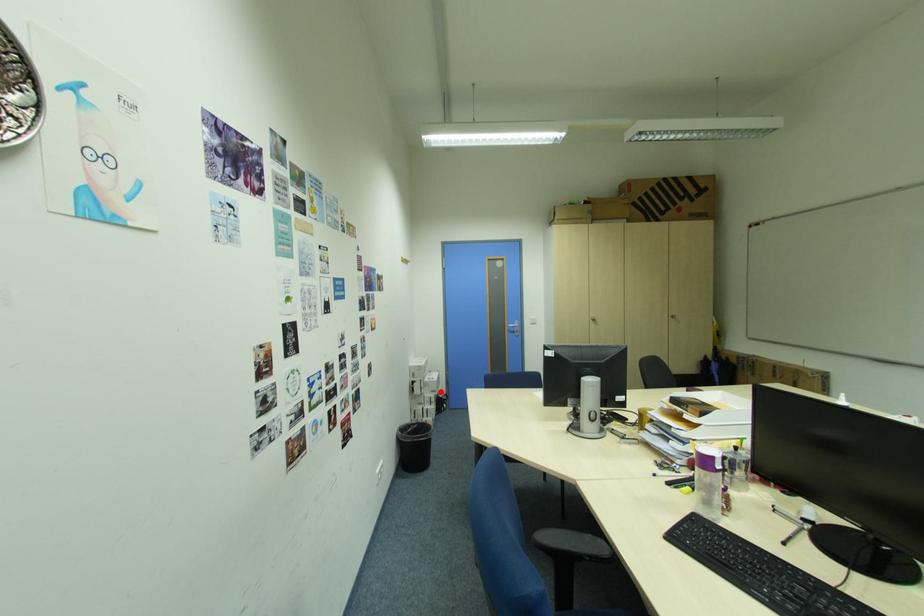
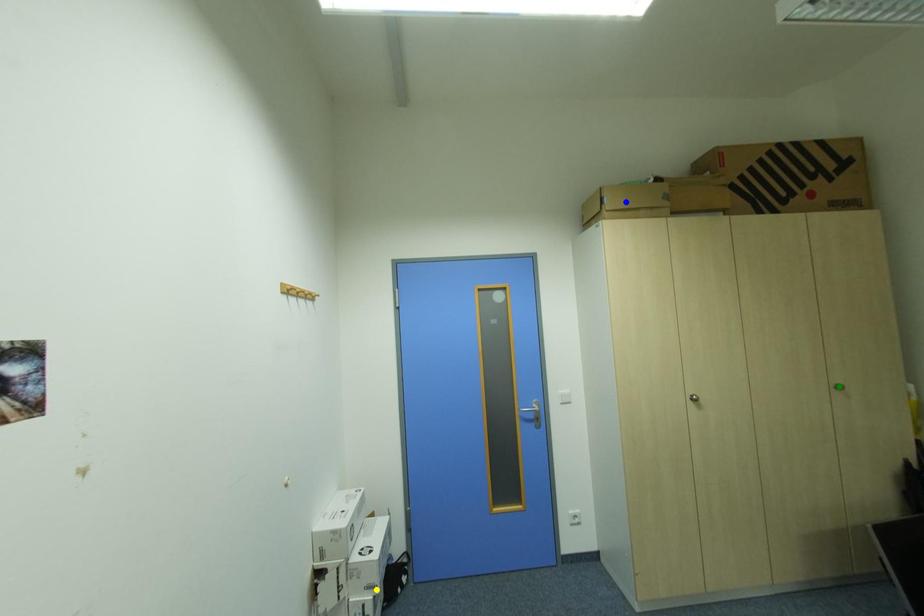
Question: I am providing you with two images of the same scene from different viewpoints. A red point is marked on the first image. You are given multiple points on the second image. Which point in image 2 represents the same 3d spot as the red point in image 1?

Choices:
 (A) green point
 (B) yellow point
 (C) blue point

Answer: (B)